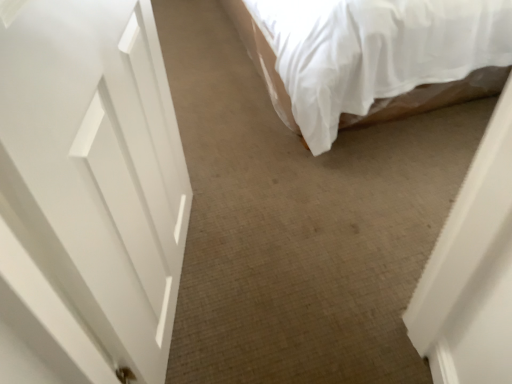
At what (x,y) coordinates should I click in order to perform the action: click on vacant space behind white glossy door at left. Please return your answer as a coordinate pair (x, y). The height and width of the screenshot is (384, 512). Looking at the image, I should click on (237, 183).